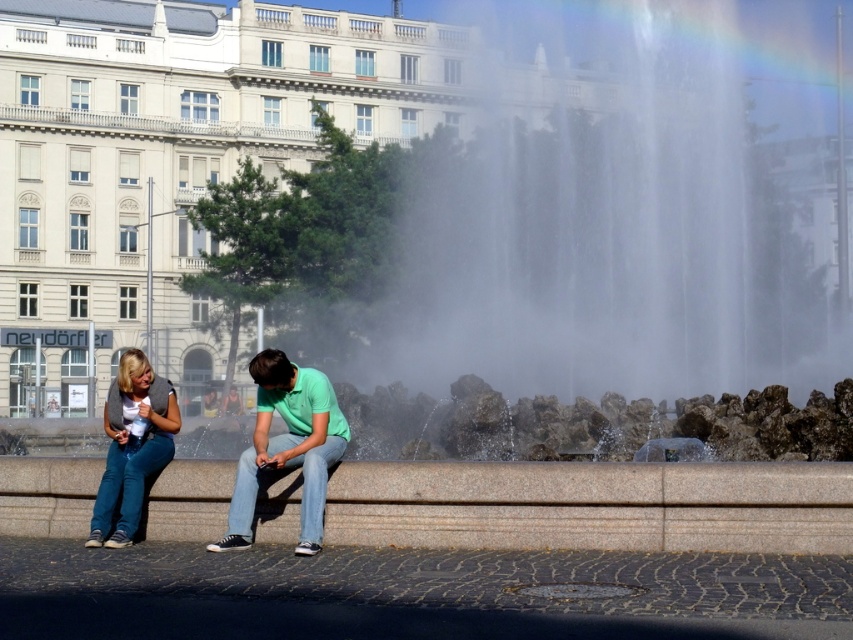
Question: Can you confirm if denim jeans at center is positioned below denim jeans at lower left?

Choices:
 (A) no
 (B) yes

Answer: (A)

Question: Can you confirm if denim jeans at center is positioned above denim jeans at lower left?

Choices:
 (A) no
 (B) yes

Answer: (B)

Question: Which point is farther to the camera?

Choices:
 (A) denim jeans at lower left
 (B) denim jeans at center

Answer: (A)

Question: Is denim jeans at center below denim jeans at lower left?

Choices:
 (A) no
 (B) yes

Answer: (A)

Question: Which of the following is the farthest from the observer?

Choices:
 (A) (141, 394)
 (B) (96, 532)

Answer: (A)